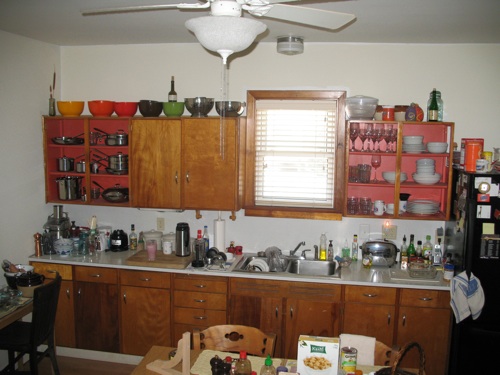
This screenshot has width=500, height=375. What are the coordinates of `cereal box` in the screenshot? It's located at (321, 358), (309, 353), (313, 350).